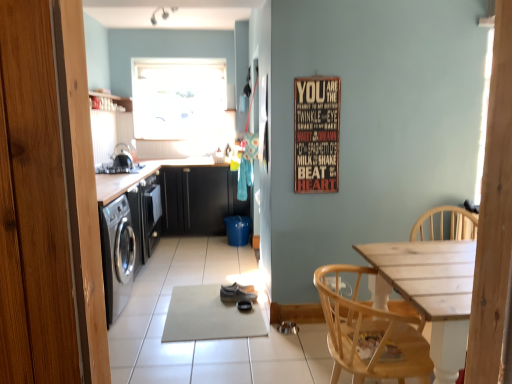
Question: From a real-world perspective, is light wood chair at lower right above or below black matte cabinet at center, the 2th cabinetry viewed from the front?

Choices:
 (A) above
 (B) below

Answer: (B)

Question: Choose the correct answer: Is light wood chair at lower right inside black matte cabinet at center, the 2th cabinetry viewed from the front, or outside it?

Choices:
 (A) outside
 (B) inside

Answer: (A)

Question: Estimate the real-world distances between objects in this image. Which object is farther from the black matte cabinetry at left, the 1th cabinetry from the front?

Choices:
 (A) transparent glass window at upper center
 (B) matte gray shoe at center
 (C) wooden signboard at upper right
 (D) shiny metallic kettle at left
 (E) black matte cabinet at center, the 2th cabinetry viewed from the front

Answer: (C)

Question: Considering the real-world distances, which object is closest to the black matte cabinet at center, which is the first cabinetry from back to front?

Choices:
 (A) black matte cabinetry at left, which is the second cabinetry from back to front
 (B) wooden signboard at upper right
 (C) gray fabric ironing board at center
 (D) light wood chair at lower right
 (E) satin black stove at upper left

Answer: (A)